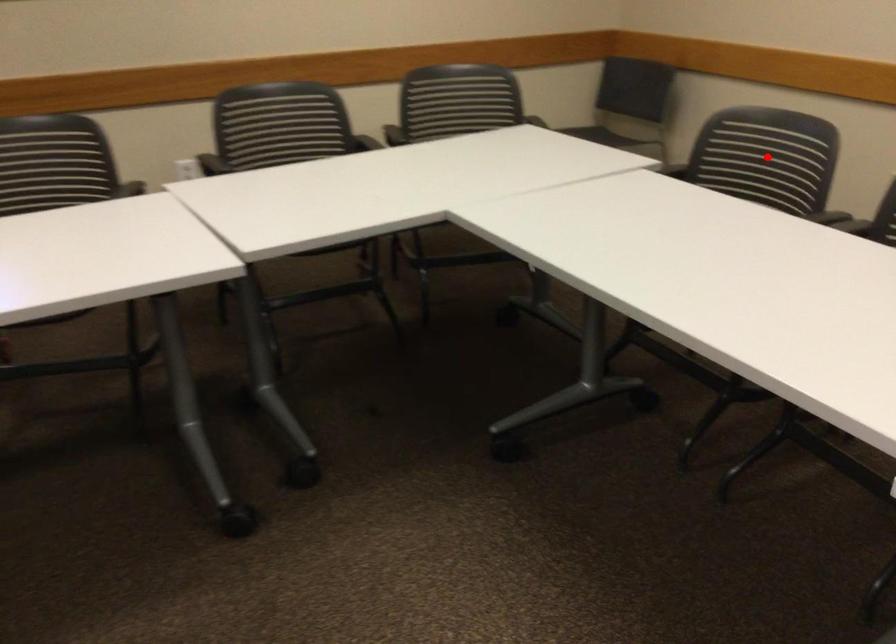
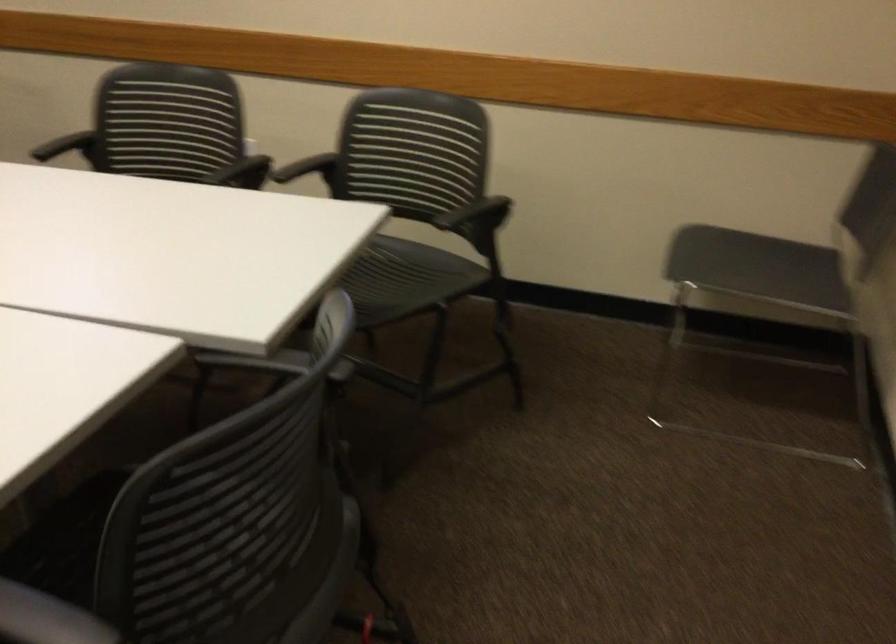
Question: I am providing you with two images of the same scene from different viewpoints. A red point is marked on the first image. Is the red point's position out of view in image 2?

Choices:
 (A) Yes
 (B) No

Answer: (A)